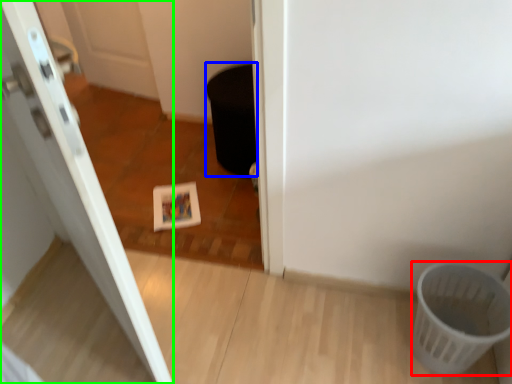
Question: Which object is the closest to the basket (highlighted by a red box)? Choose among these: potty (highlighted by a blue box) or door (highlighted by a green box).

Choices:
 (A) potty
 (B) door

Answer: (B)